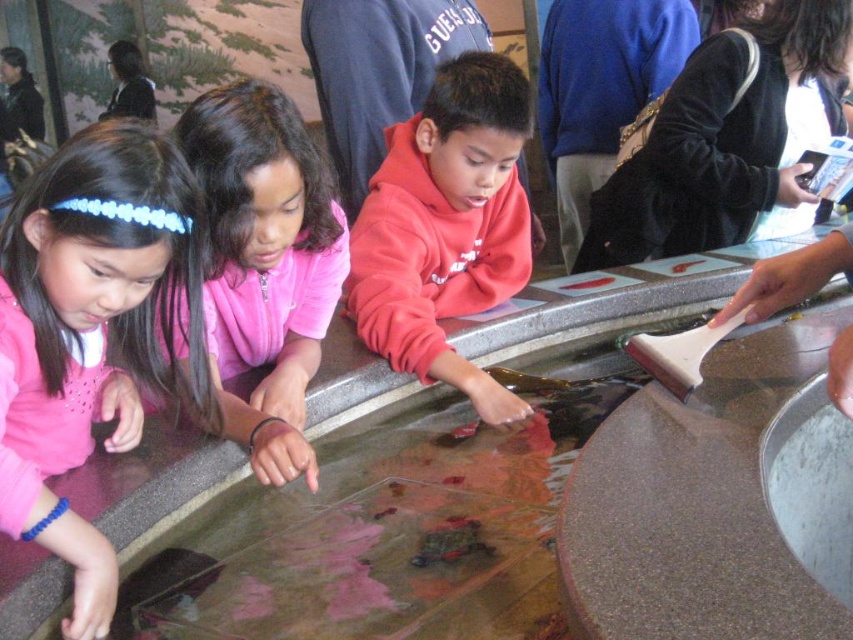
Question: Which of the following is the closest to the observer?

Choices:
 (A) (473, 365)
 (B) (344, 232)

Answer: (B)

Question: Does pink fleece jacket at left have a larger size compared to pink fleece jacket at center?

Choices:
 (A) yes
 (B) no

Answer: (B)

Question: Does red fleece sweatshirt at center lie behind pink fleece jacket at center?

Choices:
 (A) no
 (B) yes

Answer: (B)

Question: Estimate the real-world distances between objects in this image. Which object is closer to the pink fleece jacket at center?

Choices:
 (A) pink fleece jacket at left
 (B) red fleece sweatshirt at center

Answer: (A)

Question: Is the position of pink fleece jacket at left more distant than that of pink fleece jacket at center?

Choices:
 (A) no
 (B) yes

Answer: (A)

Question: Which object is the closest to the red fleece sweatshirt at center?

Choices:
 (A) pink fleece jacket at center
 (B) pink fleece jacket at left

Answer: (A)